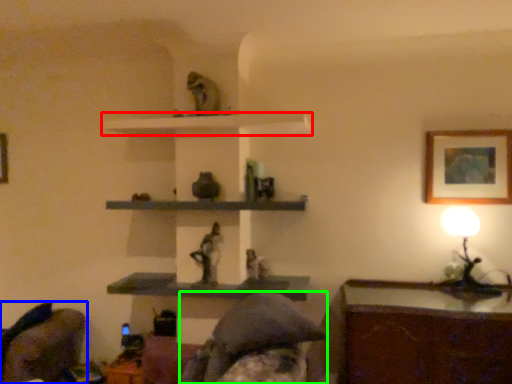
Question: Considering the real-world distances, which object is farthest from shelf (highlighted by a red box)? swivel chair (highlighted by a blue box) or person (highlighted by a green box)?

Choices:
 (A) swivel chair
 (B) person

Answer: (A)